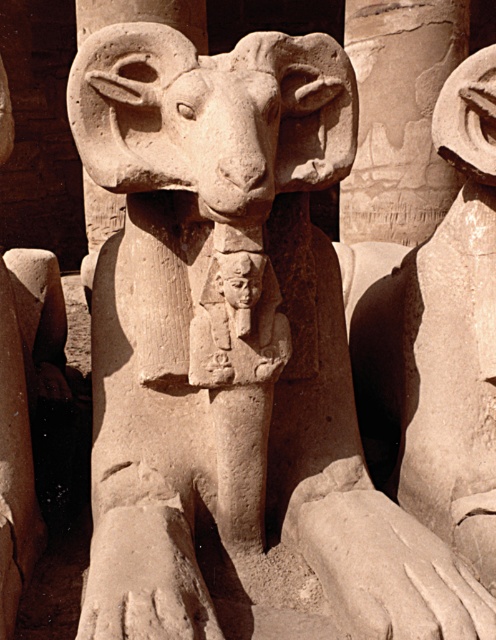
Question: Is smooth stone column at center further to the viewer compared to smooth stone ram at center?

Choices:
 (A) no
 (B) yes

Answer: (B)

Question: Does smooth stone column at center have a larger size compared to smooth stone ram at center?

Choices:
 (A) yes
 (B) no

Answer: (A)

Question: Among these objects, which one is nearest to the camera?

Choices:
 (A) smooth stone column at center
 (B) smooth stone ram at center

Answer: (B)

Question: Does smooth stone column at center appear under smooth stone ram at center?

Choices:
 (A) no
 (B) yes

Answer: (A)